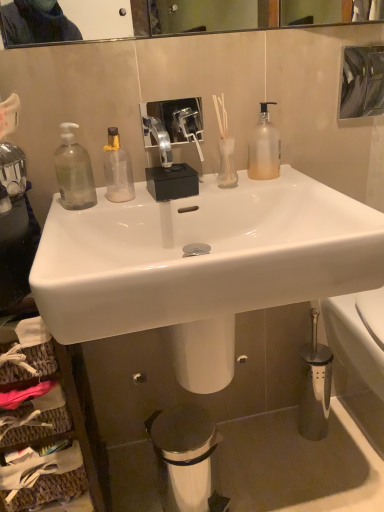
Locate an element on the screen. unoccupied space behind metallic trash can at lower center is located at coordinates tap(211, 455).